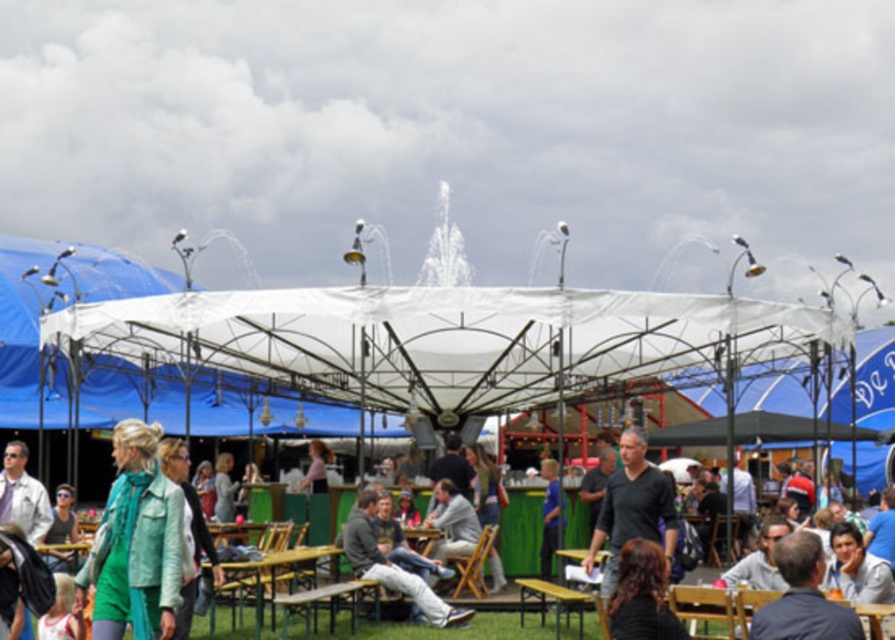
You are organizing a photo shoot and need to ensure that two jackets, the green fabric jacket at center and the matte gray jacket at center, are displayed side by side. Given their sizes, which jacket should be placed on the left to create a visually balanced composition?

The green fabric jacket at center should be placed on the left because its larger width compared to the matte gray jacket at center will help balance the composition by placing the larger item on the side opposite to the smaller one, creating symmetry.

You are organizing a small event and need to place a new decorative item on the available space. Given the matte gray jacket at center and the yellow wood table at center, which object has more space to accommodate the item?

The yellow wood table at center has more space to accommodate the item since the matte gray jacket at center occupies less space than it.